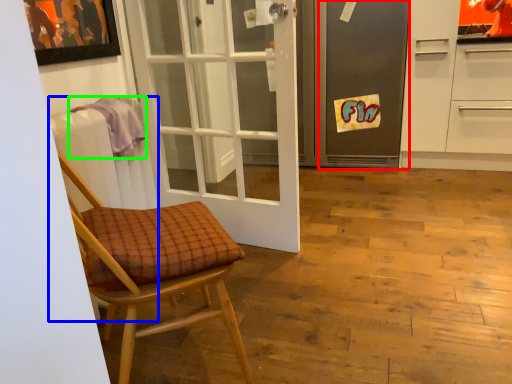
Question: Which object is the closest to the screen door (highlighted by a red box)? Choose among these: radiator (highlighted by a blue box) or towel/napkin (highlighted by a green box).

Choices:
 (A) radiator
 (B) towel/napkin

Answer: (B)